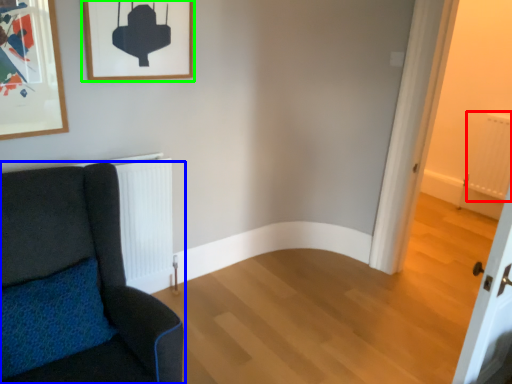
Question: Which is nearer to the radiator (highlighted by a red box)? chair (highlighted by a blue box) or picture frame (highlighted by a green box).

Choices:
 (A) chair
 (B) picture frame

Answer: (B)